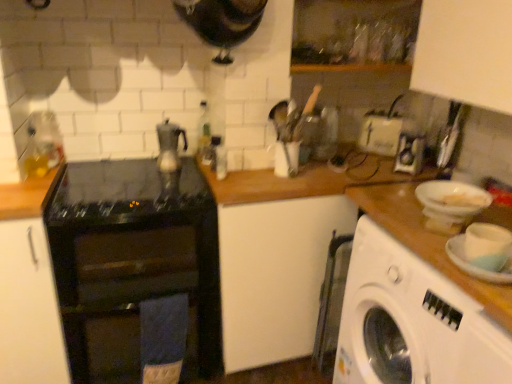
Measure the distance between transparent glass bottle at upper center and camera.

transparent glass bottle at upper center is 5.74 feet away from camera.

Identify the location of satin silver teapot at center. The image size is (512, 384). (169, 146).

Based on the photo, measure the distance between point (x=80, y=357) and camera.

The depth of point (x=80, y=357) is 5.75 feet.

How much space does metallic silver kettle at center, placed as the second appliance when sorted from back to front, occupy vertically?

metallic silver kettle at center, placed as the second appliance when sorted from back to front, is 5.93 inches in height.

What do you see at coordinates (412, 322) in the screenshot? The width and height of the screenshot is (512, 384). I see `white plastic washing machine at right` at bounding box center [412, 322].

You are a GUI agent. You are given a task and a screenshot of the screen. Output one action in this format:
    pyautogui.click(x=<x>, y=<y>)
    Task: Click on the transparent glass bottle at upper center
    
    Given the screenshot: What is the action you would take?
    pyautogui.click(x=203, y=129)

Considering the positions of point (178, 128) and point (49, 262), is point (178, 128) closer or farther from the camera than point (49, 262)?

Point (178, 128) appears to be farther away from the viewer than point (49, 262).

In the scene shown: Between satin silver teapot at center and black glossy cabinet at left, which one has more height?

black glossy cabinet at left is taller.

Looking at this image, which is more to the left, satin silver teapot at center or black glossy cabinet at left?

From the viewer's perspective, black glossy cabinet at left appears more on the left side.

Is black glossy cabinet at left inside the boundaries of black glass gas stove at center, or outside?

black glossy cabinet at left exists outside the volume of black glass gas stove at center.

Consider the image. How many degrees apart are the facing directions of black glossy cabinet at left and black glass gas stove at center?

0.000831 degrees.

From the image's perspective, is black glossy cabinet at left over black glass gas stove at center?

No.

Can you tell me how much white matte plate at right and white plastic washing machine at right differ in facing direction?

There is a 7.22-degree angle between the facing directions of white matte plate at right and white plastic washing machine at right.

Which is in front, white matte plate at right or white plastic washing machine at right?

white matte plate at right is closer to the camera.

From the image's perspective, is white matte plate at right above or below white plastic washing machine at right?

Based on their image positions, white matte plate at right is located above white plastic washing machine at right.

In terms of width, does white matte plate at right look wider or thinner when compared to white plastic washing machine at right?

Clearly, white matte plate at right has less width compared to white plastic washing machine at right.

At what (x,y) coordinates should I click in order to perform the action: click on appliance below the white plastic basin at right (from a real-world perspective). Please return your answer as a coordinate pair (x, y). The width and height of the screenshot is (512, 384). Looking at the image, I should click on pos(211,151).

From the picture: Can you tell me how much metallic silver kettle at center, which ranks as the second appliance in right-to-left order, and white plastic basin at right differ in facing direction?

There is a 9.02-degree angle between the facing directions of metallic silver kettle at center, which ranks as the second appliance in right-to-left order, and white plastic basin at right.

Can you confirm if metallic silver kettle at center, the 1th appliance viewed from the front, is shorter than white plastic basin at right?

Incorrect, the height of metallic silver kettle at center, the 1th appliance viewed from the front, does not fall short of that of white plastic basin at right.

Is metallic silver kettle at center, which ranks as the second appliance in right-to-left order, looking in the opposite direction of white plastic basin at right?

No, metallic silver kettle at center, which ranks as the second appliance in right-to-left order, is not facing away from white plastic basin at right.

How much distance is there between transparent glass bottle at upper center and white plastic basin at right?

transparent glass bottle at upper center is 95.04 centimeters away from white plastic basin at right.

Is transparent glass bottle at upper center facing towards white plastic basin at right?

No, transparent glass bottle at upper center does not turn towards white plastic basin at right.

From the image's perspective, who appears lower, transparent glass bottle at upper center or white plastic basin at right?

white plastic basin at right is shown below in the image.

Which is in front, transparent glass bottle at upper center or white plastic basin at right?

Positioned in front is white plastic basin at right.

Is transparent glass bottle at upper center completely or partially outside of satin silver teapot at center?

That's correct, transparent glass bottle at upper center is outside of satin silver teapot at center.

How far apart are transparent glass bottle at upper center and satin silver teapot at center?

14.83 centimeters.

Which object is closer to the camera taking this photo, transparent glass bottle at upper center or satin silver teapot at center?

satin silver teapot at center.

From the picture: Considering the positions of objects transparent glass bottle at upper center and satin silver teapot at center in the image provided, who is more to the right, transparent glass bottle at upper center or satin silver teapot at center?

transparent glass bottle at upper center.

In the image, is white matte plate at right on the left side or the right side of black glossy cabinet at left?

white matte plate at right is positioned on black glossy cabinet at left's right side.

Can you confirm if white matte plate at right is shorter than black glossy cabinet at left?

Yes.

Is white matte plate at right aimed at black glossy cabinet at left?

No, white matte plate at right is not facing towards black glossy cabinet at left.

Would you say white matte plate at right is a long distance from black glossy cabinet at left?

white matte plate at right is far away from black glossy cabinet at left.

Locate an element on the screen. Image resolution: width=512 pixels, height=384 pixels. tea pot above the black glossy cabinet at left (from a real-world perspective) is located at coordinates (169, 146).

This screenshot has height=384, width=512. I want to click on gas stove to the right of black glossy cabinet at left, so point(124,192).

From the image, which object appears to be farther from white plastic washing machine at right, metallic silver kettle at center, placed as the second appliance when sorted from back to front, or black glossy cabinet at left?

Among the two, black glossy cabinet at left is located further to white plastic washing machine at right.

Looking at the image, which one is located further to black glossy cabinet at left, black glass stove at center or transparent glass bottle at upper center?

transparent glass bottle at upper center lies further to black glossy cabinet at left than the other object.

When comparing their distances from satin silver teapot at center, does white plastic washing machine at right or transparent glass bottle at upper center seem closer?

transparent glass bottle at upper center is closer to satin silver teapot at center.

Which object lies nearer to the anchor point white plastic toaster at center, which is the 2th appliance in front-to-back order, black glossy cabinet at left or satin silver teapot at center?

Based on the image, satin silver teapot at center appears to be nearer to white plastic toaster at center, which is the 2th appliance in front-to-back order.

Based on their spatial positions, is black glossy cabinet at left or white plastic basin at right further from metallic silver kettle at center, which ranks as the second appliance in right-to-left order?

white plastic basin at right lies further to metallic silver kettle at center, which ranks as the second appliance in right-to-left order, than the other object.

Estimate the real-world distances between objects in this image. Which object is further from black glass stove at center, white plastic basin at right or black glass gas stove at center?

white plastic basin at right is positioned further to the anchor black glass stove at center.

Which object lies nearer to the anchor point white matte plate at right, white plastic basin at right or black glass gas stove at center?

white plastic basin at right is positioned closer to the anchor white matte plate at right.

Based on their spatial positions, is white plastic toaster at center, acting as the first appliance starting from the right, or black glossy cabinet at left further from white plastic washing machine at right?

black glossy cabinet at left is positioned further to the anchor white plastic washing machine at right.

Locate an element on the screen. The width and height of the screenshot is (512, 384). tea pot between black glass gas stove at center and white matte plate at right from left to right is located at coordinates (169, 146).

Where is `basin located between transparent glass bottle at upper center and white plastic washing machine at right in the left-right direction`? This screenshot has width=512, height=384. basin located between transparent glass bottle at upper center and white plastic washing machine at right in the left-right direction is located at coordinates (451, 200).

I want to click on basin between black glossy cabinet at left and white plastic washing machine at right in the horizontal direction, so click(451, 200).

In order to click on basin between black glass stove at center and white plastic toaster at center, acting as the first appliance starting from the right, in the horizontal direction in this screenshot , I will do `click(451, 200)`.